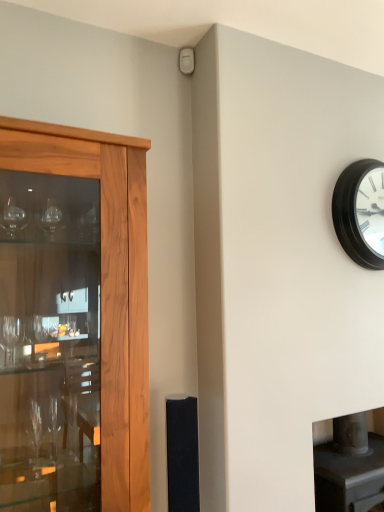
Question: In terms of width, does black matte clock at upper right look wider or thinner when compared to black matte speaker at center?

Choices:
 (A) thin
 (B) wide

Answer: (A)

Question: Would you say black matte clock at upper right is to the left or to the right of black matte speaker at center in the picture?

Choices:
 (A) right
 (B) left

Answer: (A)

Question: Estimate the real-world distances between objects in this image. Which object is farther from the black matte speaker at center?

Choices:
 (A) wooden cabinet at left
 (B) black matte clock at upper right

Answer: (B)

Question: Estimate the real-world distances between objects in this image. Which object is closer to the wooden cabinet at left?

Choices:
 (A) black matte speaker at center
 (B) black matte clock at upper right

Answer: (A)